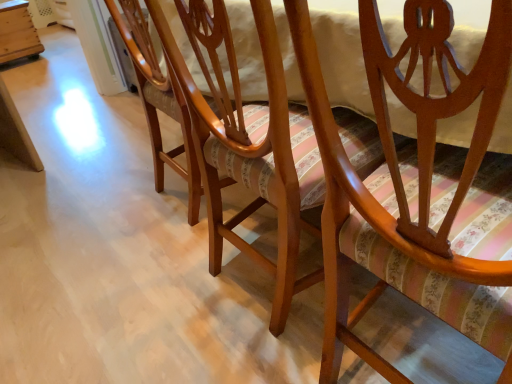
Question: From the image's perspective, is wooden crate at left below wooden chair at center, which is the 2th chair from front to back?

Choices:
 (A) no
 (B) yes

Answer: (A)

Question: Can you see wooden crate at left touching wooden chair at center, the 2th chair positioned from the right?

Choices:
 (A) yes
 (B) no

Answer: (B)

Question: Does wooden crate at left have a lesser width compared to wooden chair at center, positioned as the 1th chair in left-to-right order?

Choices:
 (A) no
 (B) yes

Answer: (A)

Question: Considering the relative positions of wooden crate at left and wooden chair at center, which ranks as the 1th chair in back-to-front order, in the image provided, is wooden crate at left in front of wooden chair at center, which ranks as the 1th chair in back-to-front order,?

Choices:
 (A) no
 (B) yes

Answer: (A)

Question: From the image's perspective, is wooden crate at left on top of wooden chair at center, which ranks as the 1th chair in back-to-front order?

Choices:
 (A) yes
 (B) no

Answer: (A)

Question: From the image's perspective, is wooden chair at center, which ranks as the 1th chair in back-to-front order, located above or below matte wood chair at center, placed as the second chair when sorted from back to front?

Choices:
 (A) below
 (B) above

Answer: (B)

Question: Is wooden chair at center, which ranks as the 1th chair in back-to-front order, bigger or smaller than matte wood chair at center, placed as the second chair when sorted from back to front?

Choices:
 (A) big
 (B) small

Answer: (B)

Question: Is wooden chair at center, the 2th chair positioned from the right, spatially inside matte wood chair at center, placed as the second chair when sorted from back to front, or outside of it?

Choices:
 (A) inside
 (B) outside

Answer: (B)

Question: Considering the relative positions of wooden chair at center, which ranks as the 1th chair in back-to-front order, and matte wood chair at center, which is the 1th chair in right-to-left order, in the image provided, is wooden chair at center, which ranks as the 1th chair in back-to-front order, to the left or to the right of matte wood chair at center, which is the 1th chair in right-to-left order,?

Choices:
 (A) right
 (B) left

Answer: (B)

Question: From the image's perspective, is wooden crate at left positioned above or below matte wood chair at center, the first chair when ordered from front to back?

Choices:
 (A) above
 (B) below

Answer: (A)

Question: From a real-world perspective, is wooden crate at left physically located above or below matte wood chair at center, which is the 1th chair in right-to-left order?

Choices:
 (A) above
 (B) below

Answer: (B)

Question: In the image, is wooden crate at left positioned in front of or behind matte wood chair at center, the first chair when ordered from front to back?

Choices:
 (A) behind
 (B) front

Answer: (A)

Question: Would you say wooden crate at left is inside or outside matte wood chair at center, placed as the second chair when sorted from back to front?

Choices:
 (A) inside
 (B) outside

Answer: (B)

Question: Looking at the image, does matte wood chair at center, placed as the second chair when sorted from back to front, seem bigger or smaller compared to wooden crate at left?

Choices:
 (A) small
 (B) big

Answer: (B)

Question: From a real-world perspective, is matte wood chair at center, placed as the second chair when sorted from back to front, positioned above or below wooden crate at left?

Choices:
 (A) above
 (B) below

Answer: (A)